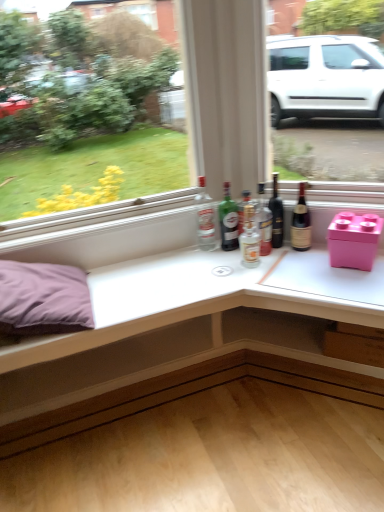
Locate an element on the screen. The height and width of the screenshot is (512, 384). free space to the left of pink plastic storage box at right is located at coordinates (302, 266).